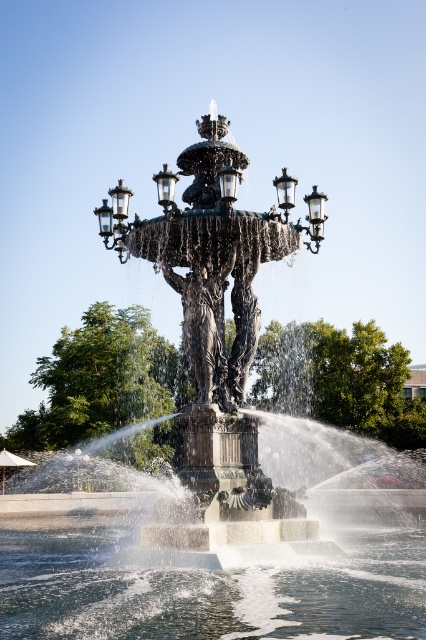
Looking at this image, is clear water at center shorter than green leafy tree at center?

Correct, clear water at center is not as tall as green leafy tree at center.

Who is more distant from viewer, (58,563) or (95,346)?

The point (95,346) is more distant.

I want to click on clear water at center, so click(210, 589).

Between bronze statue at center and clear water at center, which one is positioned lower?

clear water at center

Identify the location of bronze statue at center. (222, 380).

Is bronze statue at center wider than green leafy tree at center?

Indeed, bronze statue at center has a greater width compared to green leafy tree at center.

Measure the distance between bronze statue at center and green leafy tree at center.

The distance of bronze statue at center from green leafy tree at center is 6.55 meters.

Is point (271, 436) positioned after point (63, 440)?

No, it is not.

At what (x,y) coordinates should I click in order to perform the action: click on bronze statue at center. Please return your answer as a coordinate pair (x, y). The image size is (426, 640). Looking at the image, I should click on (x=222, y=380).